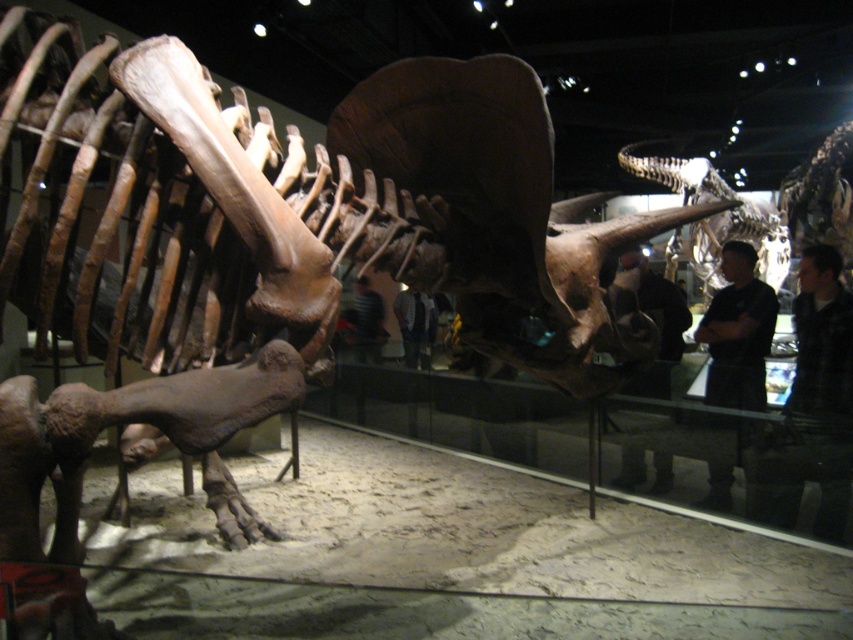
You are a visitor at the museum and notice two people standing near the Triceratops skeleton. One is wearing dark clothing at center and the other is wearing a striped shirt at center. Which person do you think is closer to you?

The dark clothing at center is larger in size than striped shirt at center, so the person wearing dark clothing at center is closer to you because objects closer appear larger.